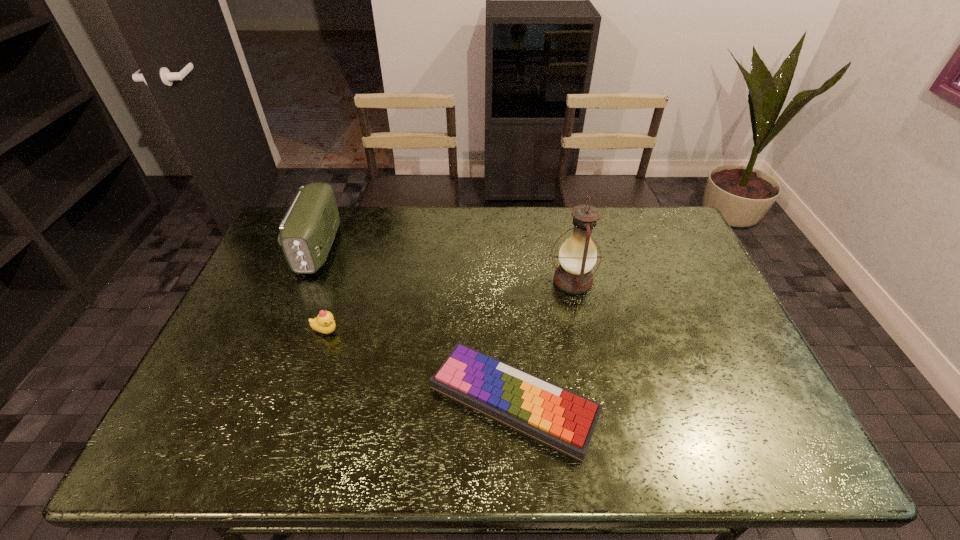
Choose which object is the third nearest neighbor to the leftmost object. Please provide its 2D coordinates. Your answer should be formatted as a tuple, i.e. [(x, y)], where the tuple contains the x and y coordinates of a point satisfying the conditions above.

[(577, 256)]

Find the location of a particular element. object that is the closest to the tallest object is located at coordinates (552, 415).

Locate an element on the screen. This screenshot has height=540, width=960. free space that satisfies the following two spatial constraints: 1. on the front side of the tallest object; 2. on the front-facing side of the second shortest object is located at coordinates (583, 331).

I want to click on vacant space that satisfies the following two spatial constraints: 1. on the front-facing side of the computer keyboard; 2. on the left side of the second object from left to right, so click(303, 400).

Image resolution: width=960 pixels, height=540 pixels. I want to click on vacant space that satisfies the following two spatial constraints: 1. on the front-facing side of the tallest object; 2. on the left side of the leftmost object, so click(305, 281).

I want to click on free point that satisfies the following two spatial constraints: 1. on the front-facing side of the leftmost object; 2. on the right side of the nearest object, so click(x=257, y=400).

Locate an element on the screen. free location that satisfies the following two spatial constraints: 1. on the front-facing side of the shortest object; 2. on the right side of the third shortest object is located at coordinates (257, 400).